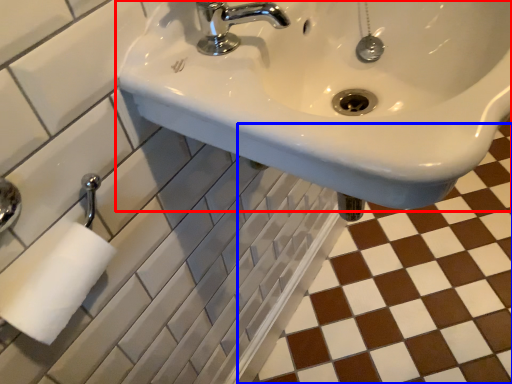
Question: Which object is further to the camera taking this photo, sink (highlighted by a red box) or ceramic tile (highlighted by a blue box)?

Choices:
 (A) sink
 (B) ceramic tile

Answer: (B)